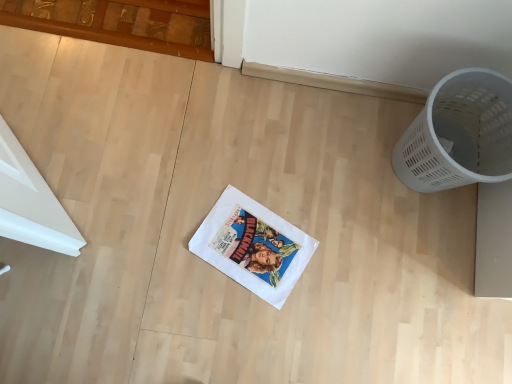
Question: Does white paper comic book at center have a greater width compared to white plastic basket at right?

Choices:
 (A) yes
 (B) no

Answer: (B)

Question: Considering the relative positions of white paper comic book at center and white plastic basket at right in the image provided, is white paper comic book at center to the left of white plastic basket at right from the viewer's perspective?

Choices:
 (A) no
 (B) yes

Answer: (B)

Question: From a real-world perspective, is white paper comic book at center on white plastic basket at right?

Choices:
 (A) yes
 (B) no

Answer: (B)

Question: Is white paper comic book at center oriented towards white plastic basket at right?

Choices:
 (A) no
 (B) yes

Answer: (A)

Question: From the image's perspective, would you say white paper comic book at center is positioned over white plastic basket at right?

Choices:
 (A) yes
 (B) no

Answer: (B)

Question: Is white paper comic book at center located outside white plastic basket at right?

Choices:
 (A) no
 (B) yes

Answer: (B)

Question: From the image's perspective, is white plastic basket at right on white paper comic book at center?

Choices:
 (A) no
 (B) yes

Answer: (B)

Question: Is white plastic basket at right taller than white paper comic book at center?

Choices:
 (A) no
 (B) yes

Answer: (B)

Question: Can you confirm if white plastic basket at right is bigger than white paper comic book at center?

Choices:
 (A) yes
 (B) no

Answer: (A)

Question: Does white plastic basket at right have a lesser width compared to white paper comic book at center?

Choices:
 (A) yes
 (B) no

Answer: (B)

Question: Is white plastic basket at right surrounding white paper comic book at center?

Choices:
 (A) no
 (B) yes

Answer: (A)

Question: From a real-world perspective, is white plastic basket at right physically above white paper comic book at center?

Choices:
 (A) yes
 (B) no

Answer: (A)

Question: From a real-world perspective, is white paper comic book at center above or below white plastic basket at right?

Choices:
 (A) above
 (B) below

Answer: (B)